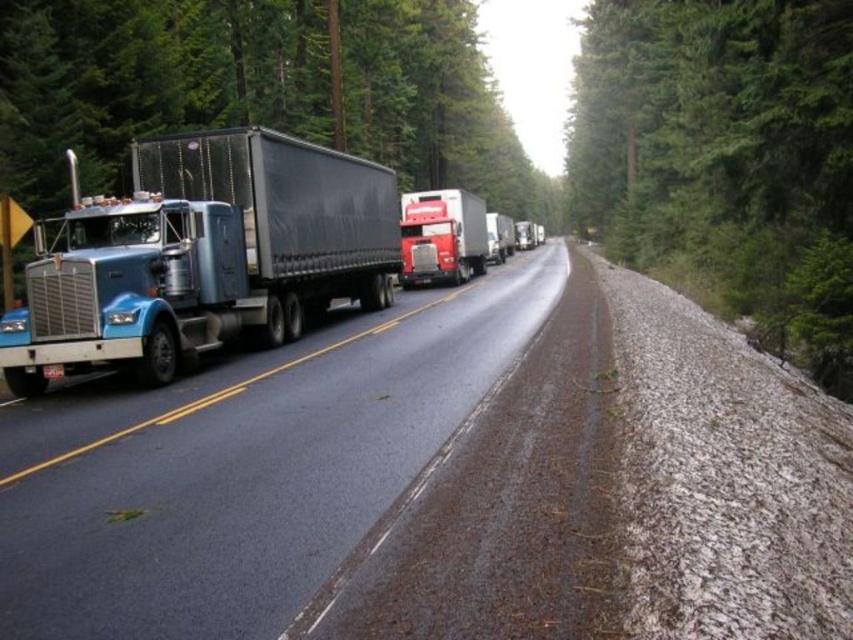
Is green textured tree at right to the left of metallic blue trailer truck at left from the viewer's perspective?

No, green textured tree at right is not to the left of metallic blue trailer truck at left.

Is point (706, 93) more distant than point (200, 324)?

Yes, point (706, 93) is behind point (200, 324).

Is point (820, 96) less distant than point (283, 336)?

Yes, it is in front of point (283, 336).

Find the location of a particular element. The height and width of the screenshot is (640, 853). green textured tree at right is located at coordinates (724, 160).

Can you confirm if black rubber highway at center is positioned below black matte truck at left?

Correct, black rubber highway at center is located below black matte truck at left.

Does black rubber highway at center have a smaller size compared to black matte truck at left?

→ Indeed, black rubber highway at center has a smaller size compared to black matte truck at left.

Between point (345, 440) and point (119, 81), which one is positioned in front?

Point (345, 440) is in front.

Locate an element on the screen. The height and width of the screenshot is (640, 853). black rubber highway at center is located at coordinates (254, 465).

In the scene shown: Is black rubber highway at center closer to the viewer compared to blue metallic truck at left?

→ Yes.

What do you see at coordinates (254, 465) in the screenshot?
I see `black rubber highway at center` at bounding box center [254, 465].

This screenshot has width=853, height=640. I want to click on black rubber highway at center, so click(x=254, y=465).